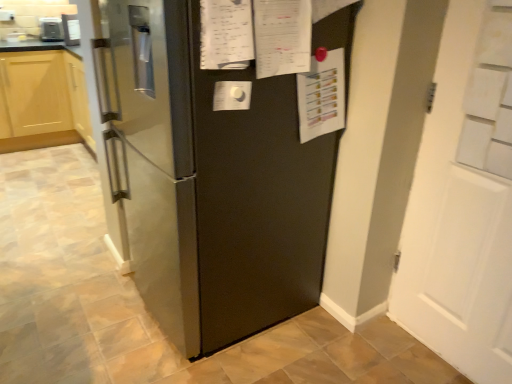
Question: From the image's perspective, is satin silver refrigerator at upper left, which is the first appliance in front-to-back order, located above or below white matte door at right?

Choices:
 (A) below
 (B) above

Answer: (B)

Question: Is satin silver refrigerator at upper left, which is the first appliance in front-to-back order, bigger or smaller than white matte door at right?

Choices:
 (A) big
 (B) small

Answer: (B)

Question: Based on their relative distances, which object is farther from the white matte door at right?

Choices:
 (A) satin black refrigerator at center
 (B) satin silver refrigerator at upper left, placed as the second appliance when sorted from back to front
 (C) satin silver toaster at upper left, acting as the 2th appliance starting from the right

Answer: (C)

Question: Which is farther from the satin black refrigerator at center?

Choices:
 (A) satin silver toaster at upper left, which is the second appliance from front to back
 (B) white matte door at right
 (C) satin silver refrigerator at upper left, which appears as the first appliance when viewed from the right

Answer: (A)